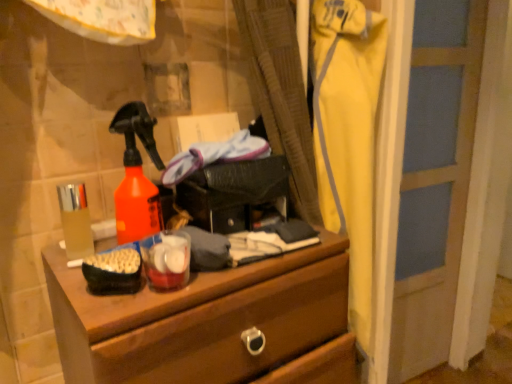
Question: Considering the relative positions of translucent plastic cup at left and yellow fabric pants at right in the image provided, is translucent plastic cup at left in front of yellow fabric pants at right?

Choices:
 (A) yes
 (B) no

Answer: (A)

Question: Considering the relative sizes of translucent plastic cup at left and yellow fabric pants at right in the image provided, is translucent plastic cup at left wider than yellow fabric pants at right?

Choices:
 (A) no
 (B) yes

Answer: (A)

Question: Can you confirm if translucent plastic cup at left is positioned to the right of yellow fabric pants at right?

Choices:
 (A) no
 (B) yes

Answer: (A)

Question: Is translucent plastic cup at left far away from yellow fabric pants at right?

Choices:
 (A) no
 (B) yes

Answer: (A)

Question: Considering the relative sizes of translucent plastic cup at left and yellow fabric pants at right in the image provided, is translucent plastic cup at left thinner than yellow fabric pants at right?

Choices:
 (A) yes
 (B) no

Answer: (A)

Question: In terms of width, does translucent plastic cup at left look wider or thinner when compared to yellow fabric pants at right?

Choices:
 (A) wide
 (B) thin

Answer: (B)

Question: Considering the positions of translucent plastic cup at left and yellow fabric pants at right in the image, is translucent plastic cup at left bigger or smaller than yellow fabric pants at right?

Choices:
 (A) small
 (B) big

Answer: (A)

Question: Considering the positions of translucent plastic cup at left and yellow fabric pants at right in the image, is translucent plastic cup at left taller or shorter than yellow fabric pants at right?

Choices:
 (A) short
 (B) tall

Answer: (A)

Question: From the image's perspective, relative to yellow fabric pants at right, is translucent plastic cup at left above or below?

Choices:
 (A) above
 (B) below

Answer: (A)

Question: Considering the positions of translucent plastic cup at left and wooden chest of drawers at center in the image, is translucent plastic cup at left taller or shorter than wooden chest of drawers at center?

Choices:
 (A) short
 (B) tall

Answer: (A)

Question: From the image's perspective, is translucent plastic cup at left located above or below wooden chest of drawers at center?

Choices:
 (A) below
 (B) above

Answer: (B)

Question: Does point (61, 205) appear closer or farther from the camera than point (151, 347)?

Choices:
 (A) closer
 (B) farther

Answer: (B)

Question: In terms of size, does translucent plastic cup at left appear bigger or smaller than wooden chest of drawers at center?

Choices:
 (A) small
 (B) big

Answer: (A)

Question: In terms of size, does wooden chest of drawers at center appear bigger or smaller than yellow fabric pants at right?

Choices:
 (A) big
 (B) small

Answer: (A)

Question: In terms of height, does wooden chest of drawers at center look taller or shorter compared to yellow fabric pants at right?

Choices:
 (A) tall
 (B) short

Answer: (B)